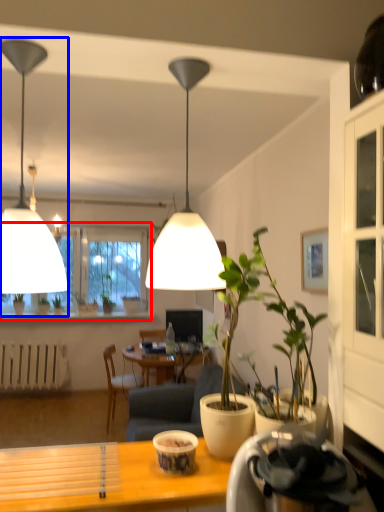
Question: Among these objects, which one is farthest to the camera, window (highlighted by a red box) or lamp (highlighted by a blue box)?

Choices:
 (A) window
 (B) lamp

Answer: (A)